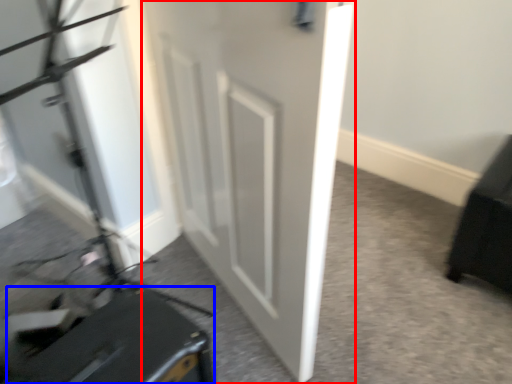
Question: Among these objects, which one is nearest to the camera, door (highlighted by a red box) or luggage (highlighted by a blue box)?

Choices:
 (A) door
 (B) luggage

Answer: (A)